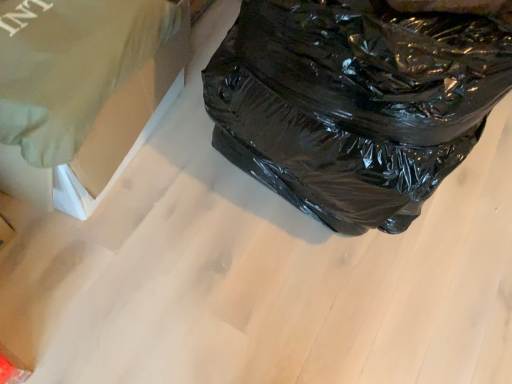
This screenshot has width=512, height=384. Identify the location of green fabric at upper left. (82, 91).

Describe the element at coordinates (82, 91) in the screenshot. I see `green fabric at upper left` at that location.

What do you see at coordinates (354, 103) in the screenshot?
I see `black plastic bag at right` at bounding box center [354, 103].

You are a GUI agent. You are given a task and a screenshot of the screen. Output one action in this format:
    pyautogui.click(x=<x>, y=<y>)
    Task: Click on the black plastic bag at right
    The height and width of the screenshot is (384, 512).
    Given the screenshot: What is the action you would take?
    pyautogui.click(x=354, y=103)

Measure the distance between point (500, 36) and camera.

Point (500, 36) is 32.60 inches away from camera.

You are a GUI agent. You are given a task and a screenshot of the screen. Output one action in this format:
    pyautogui.click(x=<x>, y=<y>)
    Task: Click on the green fabric at upper left
    The width and height of the screenshot is (512, 384).
    Given the screenshot: What is the action you would take?
    pyautogui.click(x=82, y=91)

Is green fabric at upper left to the left of black plastic bag at right from the viewer's perspective?

Correct, you'll find green fabric at upper left to the left of black plastic bag at right.

Between green fabric at upper left and black plastic bag at right, which one is positioned in front?

black plastic bag at right is more forward.

Which is further, (112, 172) or (236, 113)?

Point (112, 172)

From the image's perspective, is green fabric at upper left located beneath black plastic bag at right?

Yes.

From a real-world perspective, which is physically below, green fabric at upper left or black plastic bag at right?

From a 3D spatial view, green fabric at upper left is below.

In the scene shown: Is green fabric at upper left thinner than black plastic bag at right?

Correct, the width of green fabric at upper left is less than that of black plastic bag at right.

Can you confirm if green fabric at upper left is shorter than black plastic bag at right?

Yes, green fabric at upper left is shorter than black plastic bag at right.

Can you confirm if green fabric at upper left is bigger than black plastic bag at right?

Actually, green fabric at upper left might be smaller than black plastic bag at right.

Would you say black plastic bag at right is part of green fabric at upper left's contents?

No, green fabric at upper left does not contain black plastic bag at right.

Are green fabric at upper left and black plastic bag at right beside each other?

No, green fabric at upper left is not beside black plastic bag at right.

Is black plastic bag at right at the back of green fabric at upper left?

green fabric at upper left does not have its back to black plastic bag at right.

Can you tell me how much green fabric at upper left and black plastic bag at right differ in facing direction?

There is a 12-degree angle between the facing directions of green fabric at upper left and black plastic bag at right.

Measure the distance between green fabric at upper left and black plastic bag at right.

green fabric at upper left and black plastic bag at right are 16.52 inches apart.

Find the location of a particular element. The image size is (512, 384). plastic bag that appears on the right of green fabric at upper left is located at coordinates (354, 103).

Is black plastic bag at right to the right of green fabric at upper left from the viewer's perspective?

Correct, you'll find black plastic bag at right to the right of green fabric at upper left.

Which object is further away from the camera taking this photo, black plastic bag at right or green fabric at upper left?

green fabric at upper left.

Is point (348, 84) in front of point (131, 82)?

Yes.

From the image's perspective, does black plastic bag at right appear lower than green fabric at upper left?

No.

From a real-world perspective, who is located lower, black plastic bag at right or green fabric at upper left?

green fabric at upper left.

Between black plastic bag at right and green fabric at upper left, which one has smaller width?

Thinner between the two is green fabric at upper left.

Can you confirm if black plastic bag at right is taller than green fabric at upper left?

Yes, black plastic bag at right is taller than green fabric at upper left.

Considering the sizes of objects black plastic bag at right and green fabric at upper left in the image provided, who is smaller, black plastic bag at right or green fabric at upper left?

Smaller between the two is green fabric at upper left.

Is black plastic bag at right not within green fabric at upper left?

Yes.

Are black plastic bag at right and green fabric at upper left far apart?

No, there isn't a large distance between black plastic bag at right and green fabric at upper left.

Is black plastic bag at right turned away from green fabric at upper left?

Yes, black plastic bag at right's orientation is away from green fabric at upper left.

In the scene shown: How different are the orientations of black plastic bag at right and green fabric at upper left in degrees?

black plastic bag at right and green fabric at upper left are facing 12 degrees away from each other.

Measure the distance between black plastic bag at right and green fabric at upper left.

black plastic bag at right and green fabric at upper left are 16.52 inches apart.

This screenshot has height=384, width=512. In order to click on cardboard box below the black plastic bag at right (from the image's perspective) in this screenshot , I will do `click(82, 91)`.

Image resolution: width=512 pixels, height=384 pixels. Identify the location of plastic bag above the green fabric at upper left (from the image's perspective). (354, 103).

I want to click on plastic bag in front of the green fabric at upper left, so click(354, 103).